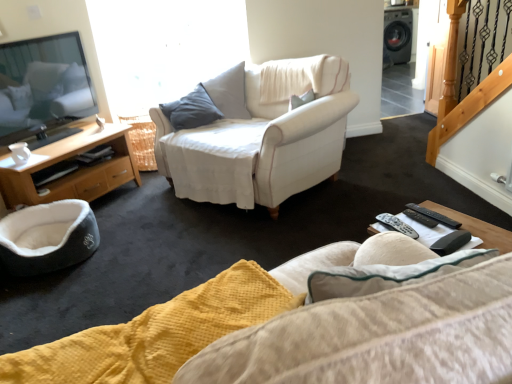
The height and width of the screenshot is (384, 512). In order to click on free space between white fabric chair at center and dark gray plush pet bed at lower left in this screenshot , I will do `click(146, 225)`.